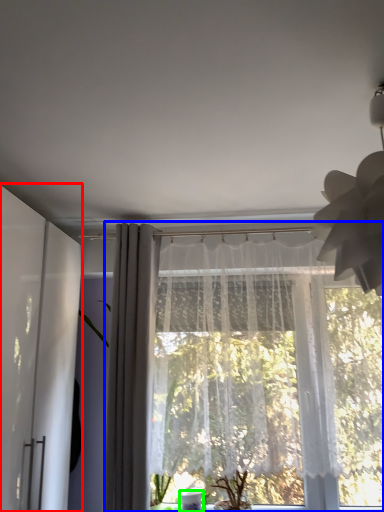
Question: Based on their relative distances, which object is farther from screen door (highlighted by a red box)? Choose from curtain (highlighted by a blue box) and glass vase (highlighted by a green box).

Choices:
 (A) curtain
 (B) glass vase

Answer: (B)